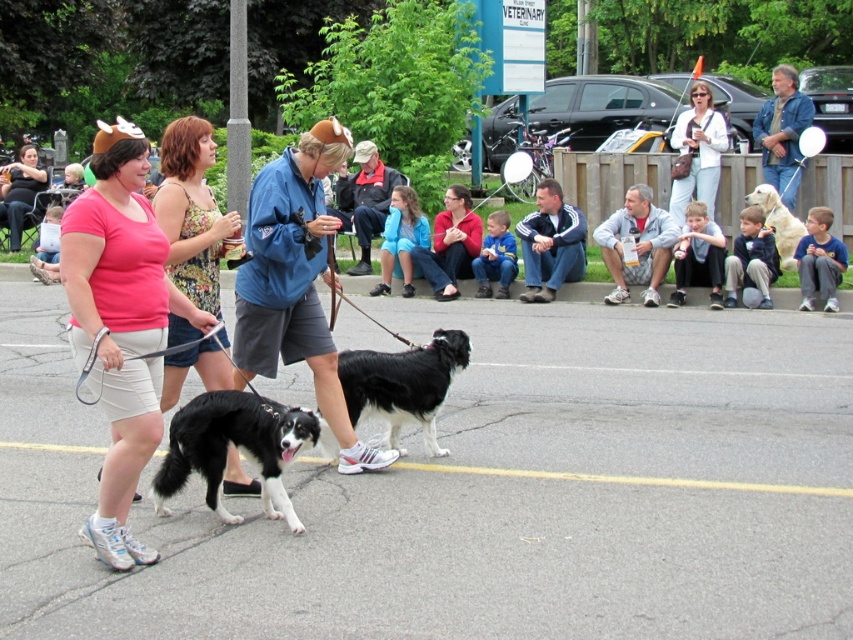
You are a photographer standing at the edge of the scene. You want to take a photo that includes both the denim jacket at upper right and the matte white shirt at upper center. What is the minimum distance you need to move backward to ensure both subjects are fully in frame?

The denim jacket at upper right is 1.29 meters from the matte white shirt at upper center. To include both in the frame, you need to move back at least 1.29 meters so that the camera can capture the entire distance between them.

You are a photographer at the event and need to capture a photo that includes both the blue athletic jacket at center and the denim jacket at upper right. Which jacket should you position lower in the frame to ensure both are visible?

To include both the blue athletic jacket at center and the denim jacket at upper right in the photo, position the blue athletic jacket at center lower in the frame since it is already located below the denim jacket at upper right.

You are a photographer at the event and want to capture both the denim jacket at upper right and the matte white shirt at upper center in the same frame. Which of the two clothing items will appear smaller in your photo?

The denim jacket at upper right will appear smaller in the photo because it is shorter than the matte white shirt at upper center.